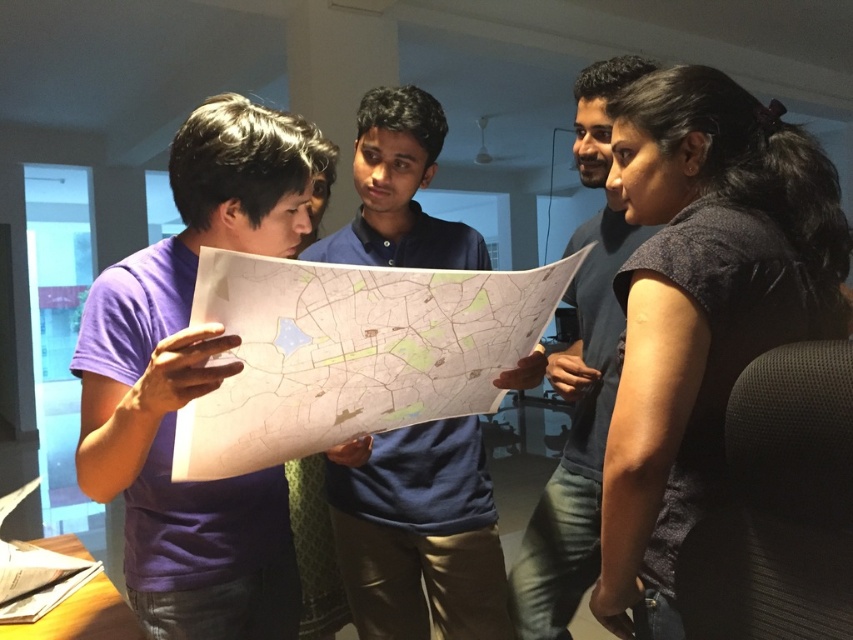
Question: Which object is the farthest from the matte blue shirt at center?

Choices:
 (A) blue cotton shirt at center
 (B) white paper map at center
 (C) purple cotton t-shirt at center
 (D) dark gray fabric shirt at upper right

Answer: (C)

Question: Is dark gray fabric shirt at upper right above purple cotton t-shirt at center?

Choices:
 (A) no
 (B) yes

Answer: (A)

Question: Does purple cotton t-shirt at center come behind matte blue shirt at center?

Choices:
 (A) no
 (B) yes

Answer: (A)

Question: From the image, what is the correct spatial relationship of blue cotton shirt at center in relation to matte blue shirt at center?

Choices:
 (A) left
 (B) right

Answer: (A)

Question: Which of these objects is positioned farthest from the purple cotton t-shirt at center?

Choices:
 (A) matte blue shirt at center
 (B) white paper map at center
 (C) dark gray fabric shirt at upper right
 (D) blue cotton shirt at center

Answer: (A)

Question: Estimate the real-world distances between objects in this image. Which object is farther from the matte blue shirt at center?

Choices:
 (A) white paper map at center
 (B) blue cotton shirt at center
 (C) dark gray fabric shirt at upper right

Answer: (A)